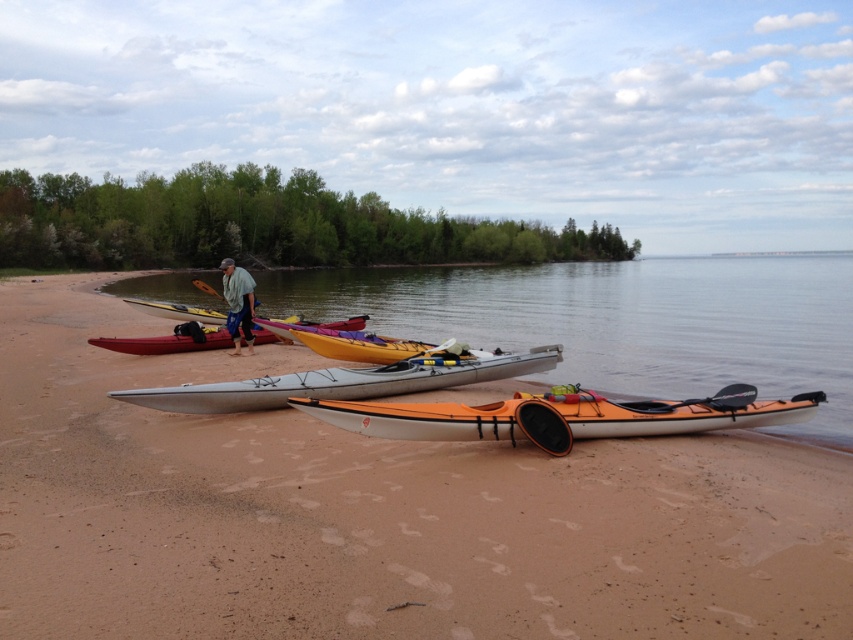
You are standing on the beach looking at the kayaks. Which kayak, the matte yellow kayak at center or the matte pink kayak at center, is closer to you?

The matte yellow kayak at center is closer to you because it is in front of the matte pink kayak at center.

You are standing on the beach and want to retrieve your orange matte kayak at center. However, there is a matte yellow kayak at center blocking your path. Based on their positions, can you reach your kayak without moving the yellow one?

The orange matte kayak at center is located below the matte yellow kayak at center, meaning it is positioned lower and closer to the water. Since the yellow kayak is above it, you can likely reach the orange kayak without moving the yellow one by accessing it from the side or behind.

You are standing on the sandy beach looking at the kayaks lined up from left to right as red, yellow, white, and orange. According to the coordinates provided, where exactly is the matte yellow kayak at center located in the image?

The matte yellow kayak at center is located at the 2D coordinates point of (x=178, y=310).